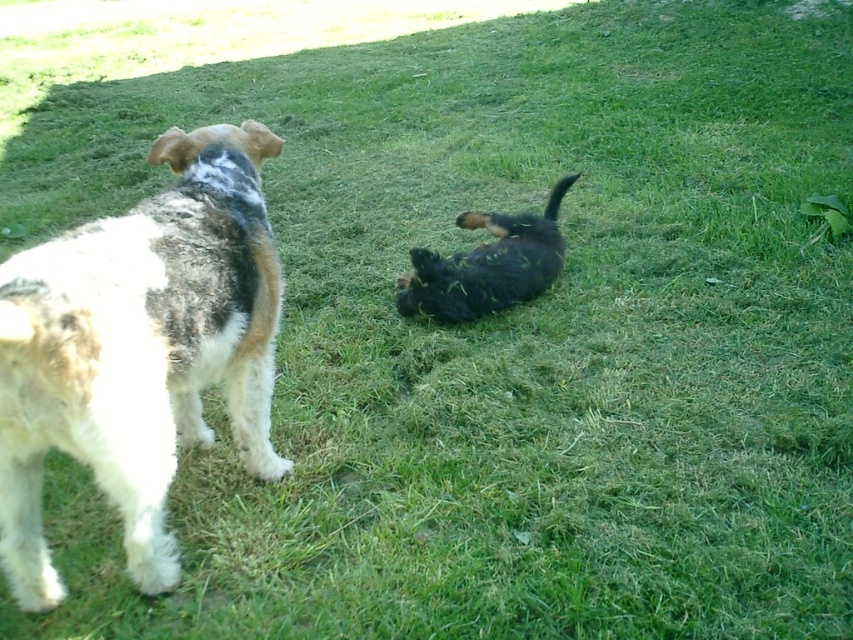
You are a photographer trying to capture both the white fur dog at left and the black fuzzy dog at center in the same frame. Based on their positions, which dog is closer to the camera?

The white fur dog at left is located below the black fuzzy dog at center, which means it is closer to the camera.